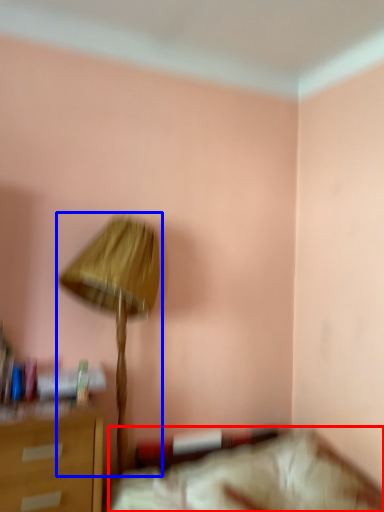
Question: Which of the following is the closest to the observer, furniture (highlighted by a red box) or lamp (highlighted by a blue box)?

Choices:
 (A) furniture
 (B) lamp

Answer: (A)